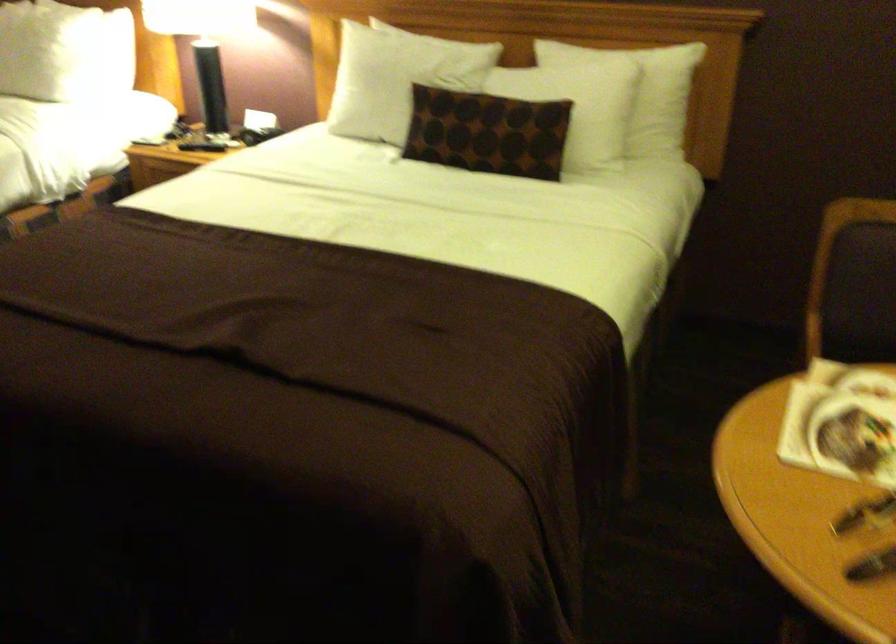
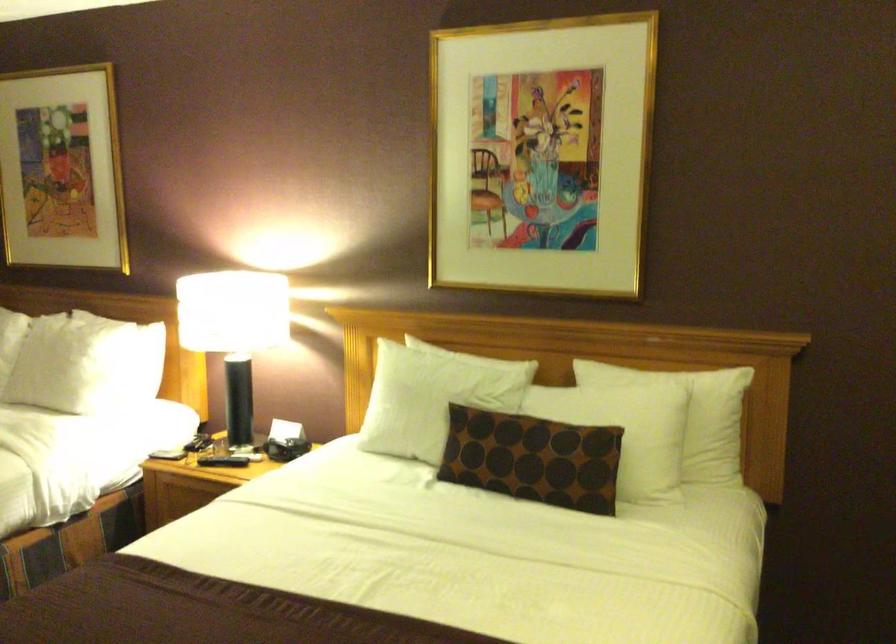
The point at (656, 98) is marked in the first image. Where is the corresponding point in the second image?

(709, 422)